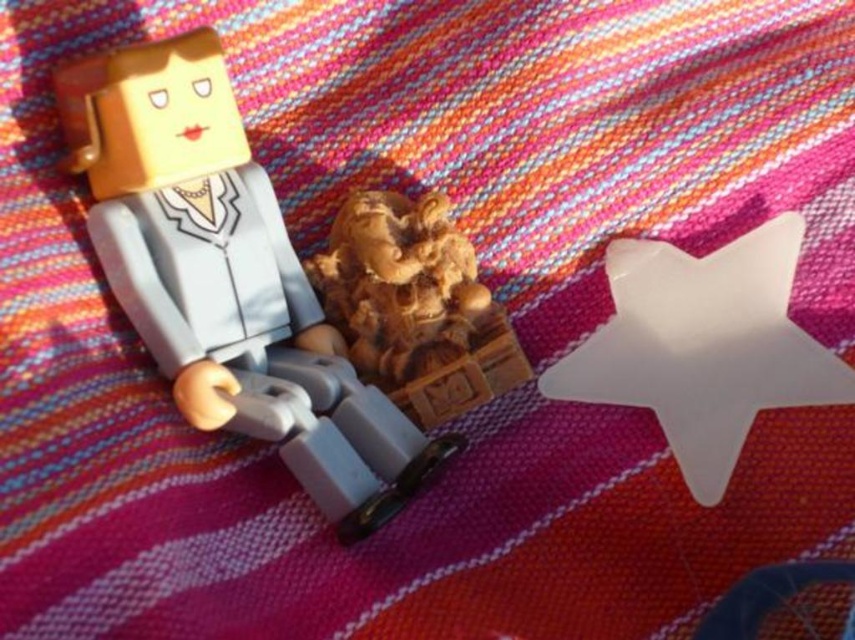
Is white matte star at upper right behind wooden carving at center?

No, white matte star at upper right is in front of wooden carving at center.

Does point (699, 413) come in front of point (402, 298)?

Yes, it is in front of point (402, 298).

Between point (783, 280) and point (354, 282), which one is positioned behind?

The point (354, 282) is more distant.

This screenshot has height=640, width=855. What are the coordinates of `white matte star at upper right` in the screenshot? It's located at point(703,346).

Does point (81, 70) lie behind point (429, 282)?

No.

Is matte plastic robot at upper left thinner than wooden carving at center?

No.

The width and height of the screenshot is (855, 640). What are the coordinates of `matte plastic robot at upper left` in the screenshot? It's located at (227, 278).

Which is above, matte plastic robot at upper left or white matte star at upper right?

matte plastic robot at upper left is higher up.

Who is more distant from viewer, (x=150, y=168) or (x=669, y=275)?

Point (x=669, y=275)

You are a GUI agent. You are given a task and a screenshot of the screen. Output one action in this format:
    pyautogui.click(x=<x>, y=<y>)
    Task: Click on the matte plastic robot at upper left
    The image size is (855, 640).
    Given the screenshot: What is the action you would take?
    pyautogui.click(x=227, y=278)